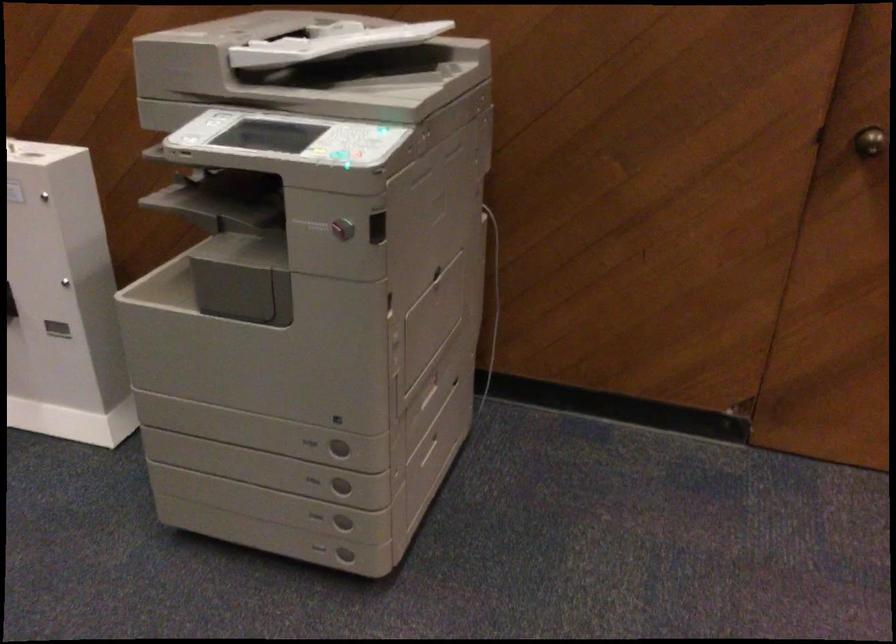
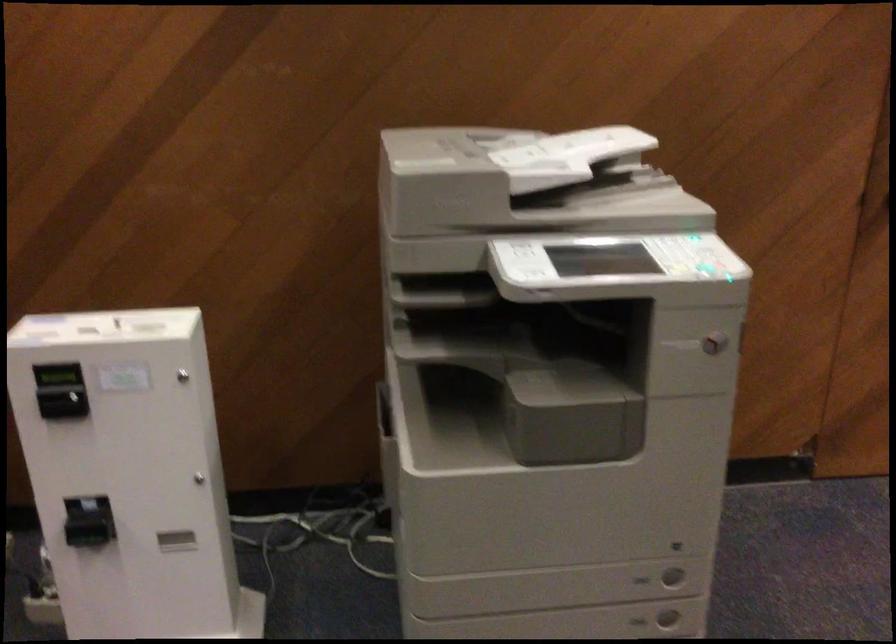
Find the pixel in the second image that matches (x=321, y=491) in the first image.

(638, 621)